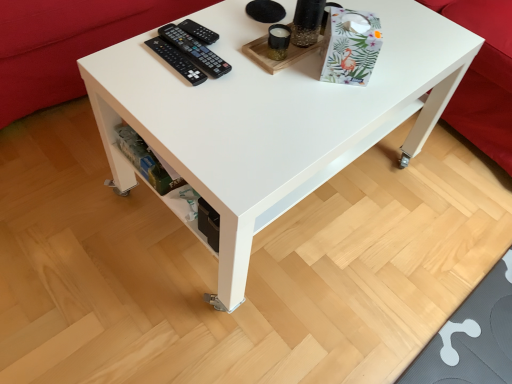
Measure the distance between point [197,32] and camera.

They are 1.06 meters apart.

This screenshot has width=512, height=384. What do you see at coordinates (272, 116) in the screenshot?
I see `white glossy table at center` at bounding box center [272, 116].

Identify the location of black plastic remote controls at upper left, the second control in the top-to-bottom sequence. (194, 50).

From the image's perspective, is black plastic remote at upper center, which ranks as the second control in bottom-to-top order, above or below red fabric couch at lower left, the 2th couch viewed from the right?

From the image's perspective, black plastic remote at upper center, which ranks as the second control in bottom-to-top order, appears below red fabric couch at lower left, the 2th couch viewed from the right.

From the image's perspective, starting from the red fabric couch at lower left, the 2th couch viewed from the right, which control is the 1st one below? Please provide its 2D coordinates.

[(199, 31)]

Can you confirm if black plastic remote at upper center, positioned as the 1th control in top-to-bottom order, is shorter than red fabric couch at lower left, the 2th couch viewed from the right?

Correct, black plastic remote at upper center, positioned as the 1th control in top-to-bottom order, is not as tall as red fabric couch at lower left, the 2th couch viewed from the right.

Could you tell me if black plastic remote at upper center, positioned as the 1th control in top-to-bottom order, is facing red fabric couch at upper right, the 1th couch viewed from the right?

No, black plastic remote at upper center, positioned as the 1th control in top-to-bottom order, does not turn towards red fabric couch at upper right, the 1th couch viewed from the right.

Is black plastic remote at upper center, positioned as the 1th control in top-to-bottom order, further to the viewer compared to red fabric couch at upper right, the 1th couch viewed from the right?

No, it is in front of red fabric couch at upper right, the 1th couch viewed from the right.

Which object is positioned more to the right, black plastic remote at upper center, positioned as the 1th control in top-to-bottom order, or red fabric couch at upper right, acting as the 2th couch starting from the left?

Positioned to the right is red fabric couch at upper right, acting as the 2th couch starting from the left.

Is red fabric couch at lower left, acting as the first couch starting from the left, turned away from black plastic remote controls at upper left, marked as the 1th control in a bottom-to-top arrangement?

red fabric couch at lower left, acting as the first couch starting from the left, is not turned away from black plastic remote controls at upper left, marked as the 1th control in a bottom-to-top arrangement.

From the red fabric couch at lower left, the 2th couch viewed from the right, count 2nd controls forward and point to it. Please provide its 2D coordinates.

[(194, 50)]

Does point (136, 30) come behind point (195, 56)?

Yes, it is.

From the image's perspective, is red fabric couch at lower left, acting as the first couch starting from the left, under black plastic remote controls at upper left, marked as the 1th control in a bottom-to-top arrangement?

No.

Considering the relative positions of black plastic remote at upper center, positioned as the 1th control in top-to-bottom order, and black plastic remote controls at upper left, marked as the 1th control in a bottom-to-top arrangement, in the image provided, is black plastic remote at upper center, positioned as the 1th control in top-to-bottom order, behind black plastic remote controls at upper left, marked as the 1th control in a bottom-to-top arrangement,?

Yes, black plastic remote at upper center, positioned as the 1th control in top-to-bottom order, is further from the camera.

Is black plastic remote at upper center, which ranks as the second control in bottom-to-top order, looking in the opposite direction of black plastic remote controls at upper left, marked as the 1th control in a bottom-to-top arrangement?

That's not correct — black plastic remote at upper center, which ranks as the second control in bottom-to-top order, is not looking away from black plastic remote controls at upper left, marked as the 1th control in a bottom-to-top arrangement.

From a real-world perspective, is black plastic remote at upper center, positioned as the 1th control in top-to-bottom order, on black plastic remote controls at upper left, the second control in the top-to-bottom sequence?

No.

Which is more to the left, black plastic remote at upper center, which ranks as the second control in bottom-to-top order, or black plastic remote controls at upper left, marked as the 1th control in a bottom-to-top arrangement?

black plastic remote controls at upper left, marked as the 1th control in a bottom-to-top arrangement.

From the image's perspective, starting from the red fabric couch at upper right, the 1th couch viewed from the right, which control is the 2nd one below? Please provide its 2D coordinates.

[(194, 50)]

Can you confirm if red fabric couch at upper right, acting as the 2th couch starting from the left, is shorter than black plastic remote controls at upper left, the second control in the top-to-bottom sequence?

In fact, red fabric couch at upper right, acting as the 2th couch starting from the left, may be taller than black plastic remote controls at upper left, the second control in the top-to-bottom sequence.

Is red fabric couch at upper right, the 1th couch viewed from the right, positioned with its back to black plastic remote controls at upper left, the second control in the top-to-bottom sequence?

That's not correct — red fabric couch at upper right, the 1th couch viewed from the right, is not looking away from black plastic remote controls at upper left, the second control in the top-to-bottom sequence.

Looking at this image, are red fabric couch at upper right, the 1th couch viewed from the right, and black plastic remote controls at upper left, marked as the 1th control in a bottom-to-top arrangement, located far from each other?

That's not correct — red fabric couch at upper right, the 1th couch viewed from the right, is a little close to black plastic remote controls at upper left, marked as the 1th control in a bottom-to-top arrangement.

Looking at the image, does white glossy table at center seem bigger or smaller compared to red fabric couch at upper right, the 1th couch viewed from the right?

Considering their sizes, white glossy table at center takes up less space than red fabric couch at upper right, the 1th couch viewed from the right.

From a real-world perspective, is white glossy table at center physically below red fabric couch at upper right, acting as the 2th couch starting from the left?

Incorrect, from a real-world perspective, white glossy table at center is higher than red fabric couch at upper right, acting as the 2th couch starting from the left.

Who is taller, white glossy table at center or red fabric couch at upper right, acting as the 2th couch starting from the left?

With more height is red fabric couch at upper right, acting as the 2th couch starting from the left.

How different are the orientations of white glossy table at center and red fabric couch at upper right, the 1th couch viewed from the right, in degrees?

87.7 degrees separate the facing orientations of white glossy table at center and red fabric couch at upper right, the 1th couch viewed from the right.

From a real-world perspective, between red fabric couch at upper right, acting as the 2th couch starting from the left, and red fabric couch at lower left, acting as the first couch starting from the left, who is vertically higher?

From a 3D spatial view, red fabric couch at upper right, acting as the 2th couch starting from the left, is above.

Who is shorter, red fabric couch at upper right, the 1th couch viewed from the right, or red fabric couch at lower left, acting as the first couch starting from the left?

red fabric couch at lower left, acting as the first couch starting from the left, is shorter.

Which is less distant, (511, 156) or (112, 37)?

Point (112, 37)

In the scene shown: Who is bigger, red fabric couch at upper right, acting as the 2th couch starting from the left, or red fabric couch at lower left, the 2th couch viewed from the right?

With larger size is red fabric couch at lower left, the 2th couch viewed from the right.

In order to click on couch that is the 1st one when counting backward from the black plastic remote at upper center, which ranks as the second control in bottom-to-top order in this screenshot , I will do `click(67, 44)`.

Where is `the 1st control to the left of the red fabric couch at upper right, acting as the 2th couch starting from the left, counting from the anchor's position`? the 1st control to the left of the red fabric couch at upper right, acting as the 2th couch starting from the left, counting from the anchor's position is located at coordinates (199, 31).

Estimate the real-world distances between objects in this image. Which object is closer to black plastic remote at upper center, positioned as the 1th control in top-to-bottom order, red fabric couch at lower left, acting as the first couch starting from the left, or red fabric couch at upper right, acting as the 2th couch starting from the left?

red fabric couch at lower left, acting as the first couch starting from the left, is positioned closer to the anchor black plastic remote at upper center, positioned as the 1th control in top-to-bottom order.

When comparing their distances from white glossy table at center, does red fabric couch at upper right, acting as the 2th couch starting from the left, or red fabric couch at lower left, the 2th couch viewed from the right, seem further?

Among the two, red fabric couch at upper right, acting as the 2th couch starting from the left, is located further to white glossy table at center.

Considering their positions, is red fabric couch at upper right, the 1th couch viewed from the right, positioned further to red fabric couch at lower left, the 2th couch viewed from the right, than white glossy table at center?

red fabric couch at upper right, the 1th couch viewed from the right, is positioned further to the anchor red fabric couch at lower left, the 2th couch viewed from the right.

Considering their positions, is white glossy table at center positioned closer to red fabric couch at lower left, acting as the first couch starting from the left, than black plastic remote controls at upper left, marked as the 1th control in a bottom-to-top arrangement?

black plastic remote controls at upper left, marked as the 1th control in a bottom-to-top arrangement.

Based on the photo, estimate the real-world distances between objects in this image. Which object is further from black plastic remote controls at upper left, marked as the 1th control in a bottom-to-top arrangement, red fabric couch at upper right, acting as the 2th couch starting from the left, or black plastic remote at upper center, which ranks as the second control in bottom-to-top order?

Based on the image, red fabric couch at upper right, acting as the 2th couch starting from the left, appears to be further to black plastic remote controls at upper left, marked as the 1th control in a bottom-to-top arrangement.

From the image, which object appears to be farther from red fabric couch at lower left, acting as the first couch starting from the left, white glossy table at center or black plastic remote at upper center, which ranks as the second control in bottom-to-top order?

white glossy table at center is further to red fabric couch at lower left, acting as the first couch starting from the left.

Based on their spatial positions, is red fabric couch at upper right, the 1th couch viewed from the right, or black plastic remote controls at upper left, marked as the 1th control in a bottom-to-top arrangement, further from red fabric couch at lower left, the 2th couch viewed from the right?

red fabric couch at upper right, the 1th couch viewed from the right.

Consider the image. When comparing their distances from red fabric couch at lower left, acting as the first couch starting from the left, does white glossy table at center or red fabric couch at upper right, acting as the 2th couch starting from the left, seem further?

Based on the image, red fabric couch at upper right, acting as the 2th couch starting from the left, appears to be further to red fabric couch at lower left, acting as the first couch starting from the left.

This screenshot has height=384, width=512. I want to click on table between red fabric couch at lower left, the 2th couch viewed from the right, and red fabric couch at upper right, acting as the 2th couch starting from the left, so click(272, 116).

You are a GUI agent. You are given a task and a screenshot of the screen. Output one action in this format:
    pyautogui.click(x=<x>, y=<y>)
    Task: Click on the table situated between black plastic remote controls at upper left, marked as the 1th control in a bottom-to-top arrangement, and red fabric couch at upper right, the 1th couch viewed from the right, from left to right
    This screenshot has height=384, width=512.
    Given the screenshot: What is the action you would take?
    pyautogui.click(x=272, y=116)

Locate an element on the screen. table between black plastic remote at upper center, positioned as the 1th control in top-to-bottom order, and red fabric couch at upper right, the 1th couch viewed from the right, from left to right is located at coordinates (272, 116).

Find the location of a particular element. Image resolution: width=512 pixels, height=384 pixels. control between white glossy table at center and black plastic remote at upper center, which ranks as the second control in bottom-to-top order, in the front-back direction is located at coordinates (194, 50).